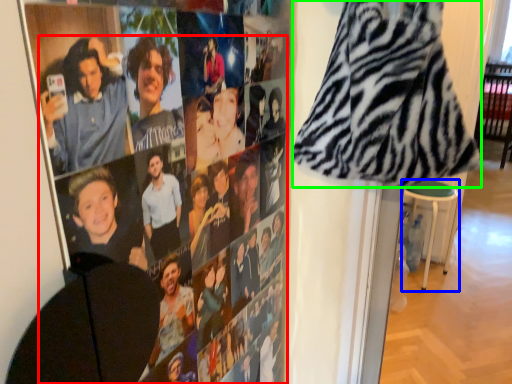
Question: Which is nearer to the person (highlighted by a red box)? bar stool (highlighted by a blue box) or blanket (highlighted by a green box).

Choices:
 (A) bar stool
 (B) blanket

Answer: (B)